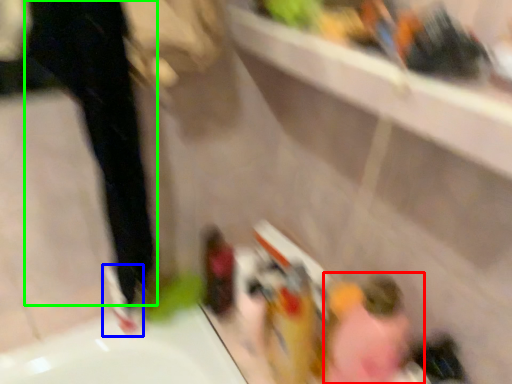
Question: Which object is the farthest from woman (highlighted by a red box)? Choose among these: shoe (highlighted by a blue box) or pants (highlighted by a green box).

Choices:
 (A) shoe
 (B) pants

Answer: (B)